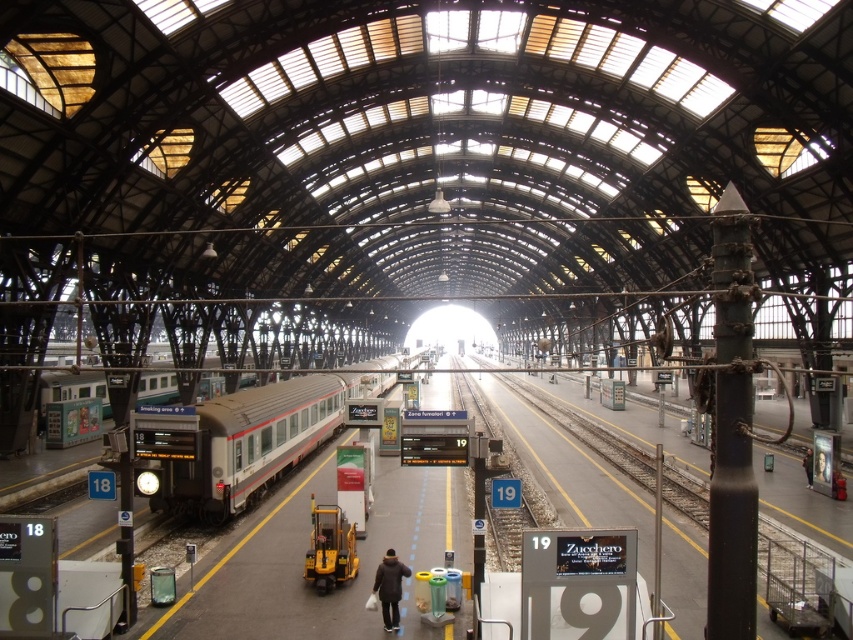
Question: Which point is closer to the camera?

Choices:
 (A) (329, 413)
 (B) (808, 483)

Answer: (B)

Question: Can you confirm if silver metallic train at left is thinner than dark brown leather jacket at center?

Choices:
 (A) no
 (B) yes

Answer: (A)

Question: Does silver metallic train at left have a greater width compared to black leather jacket at center?

Choices:
 (A) yes
 (B) no

Answer: (A)

Question: Does silver metallic train at left appear over dark brown leather jacket at center?

Choices:
 (A) yes
 (B) no

Answer: (A)

Question: Which is nearer to the black leather jacket at center?

Choices:
 (A) silver metallic train at left
 (B) dark brown leather jacket at center

Answer: (B)

Question: Which point is farther from the camera taking this photo?

Choices:
 (A) (373, 593)
 (B) (805, 461)

Answer: (B)